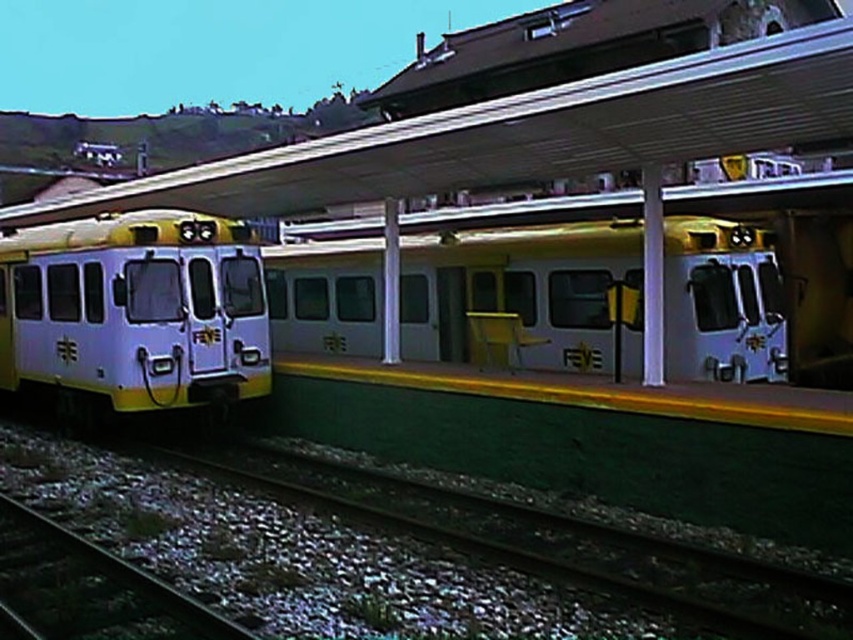
Is white glossy train at center wider than white matte train at center?

Correct, the width of white glossy train at center exceeds that of white matte train at center.

Is white glossy train at center smaller than white matte train at center?

No.

Who is more forward, (276, 300) or (236, 273)?

Point (236, 273) is more forward.

You are a GUI agent. You are given a task and a screenshot of the screen. Output one action in this format:
    pyautogui.click(x=<x>, y=<y>)
    Task: Click on the white glossy train at center
    
    Given the screenshot: What is the action you would take?
    pyautogui.click(x=524, y=296)

Who is positioned more to the left, white matte train at center or green gravel at lower left?

Answer: Positioned to the left is white matte train at center.

At what (x,y) coordinates should I click in order to perform the action: click on white matte train at center. Please return your answer as a coordinate pair (x, y). The width and height of the screenshot is (853, 640). Looking at the image, I should click on (134, 312).

Which is in front, point (38, 333) or point (306, 499)?

Point (306, 499) is in front.

Find the location of a particular element. white matte train at center is located at coordinates (134, 312).

Who is taller, white glossy train at center or dark gray metal train track at lower left?

white glossy train at center

The width and height of the screenshot is (853, 640). I want to click on white glossy train at center, so click(524, 296).